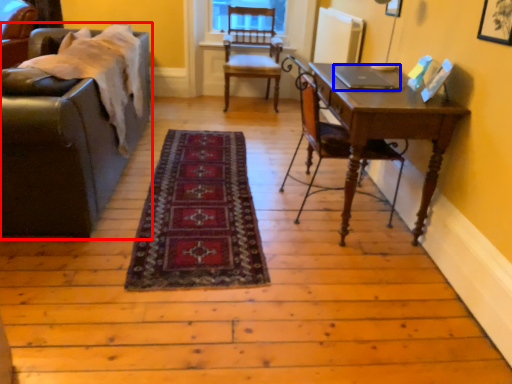
Question: Which object appears closest to the camera in this image, studio couch (highlighted by a red box) or laptop (highlighted by a blue box)?

Choices:
 (A) studio couch
 (B) laptop

Answer: (A)